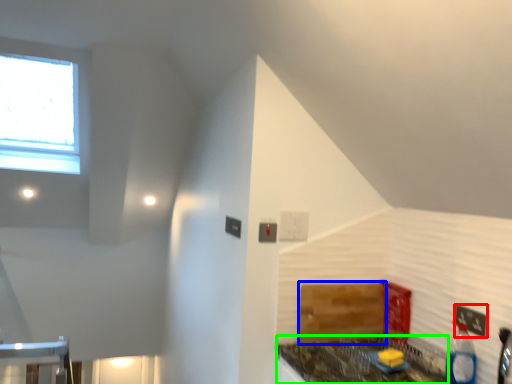
Question: Considering the real-world distances, which object is farthest from electric outlet (highlighted by a red box)? cabinetry (highlighted by a blue box) or counter top (highlighted by a green box)?

Choices:
 (A) cabinetry
 (B) counter top

Answer: (A)